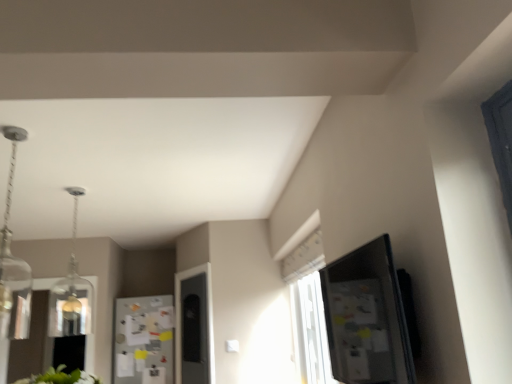
Question: Are clear glass pendant at upper left, the second light fixture positioned from the back, and white paperboard fridge at center beside each other?

Choices:
 (A) yes
 (B) no

Answer: (B)

Question: Is clear glass pendant at upper left, the second light fixture positioned from the back, oriented away from white paperboard fridge at center?

Choices:
 (A) no
 (B) yes

Answer: (A)

Question: Does clear glass pendant at upper left, the 1th light fixture from the front, appear on the right side of white paperboard fridge at center?

Choices:
 (A) no
 (B) yes

Answer: (B)

Question: From a real-world perspective, is clear glass pendant at upper left, the 1th light fixture from the front, on top of white paperboard fridge at center?

Choices:
 (A) no
 (B) yes

Answer: (B)

Question: From the image's perspective, is clear glass pendant at upper left, the second light fixture positioned from the back, under white paperboard fridge at center?

Choices:
 (A) no
 (B) yes

Answer: (A)

Question: Is clear glass pendant at upper left, the 1th light fixture from the front, wider than white paperboard fridge at center?

Choices:
 (A) yes
 (B) no

Answer: (A)

Question: Would you say white paperboard fridge at center is outside clear glass pendant light at upper left, which appears as the 2th light fixture when viewed from the front?

Choices:
 (A) no
 (B) yes

Answer: (B)

Question: From a real-world perspective, does white paperboard fridge at center stand above clear glass pendant light at upper left, which appears as the 2th light fixture when viewed from the front?

Choices:
 (A) yes
 (B) no

Answer: (B)

Question: Considering the relative positions of white paperboard fridge at center and clear glass pendant light at upper left, which appears as the 2th light fixture when viewed from the front, in the image provided, is white paperboard fridge at center to the right of clear glass pendant light at upper left, which appears as the 2th light fixture when viewed from the front, from the viewer's perspective?

Choices:
 (A) no
 (B) yes

Answer: (B)

Question: Is the position of white paperboard fridge at center more distant than that of clear glass pendant light at upper left, which appears as the 2th light fixture when viewed from the front?

Choices:
 (A) no
 (B) yes

Answer: (B)

Question: Is clear glass pendant light at upper left, which appears as the 2th light fixture when viewed from the front, inside white paperboard fridge at center?

Choices:
 (A) no
 (B) yes

Answer: (A)

Question: Considering the relative sizes of white paperboard fridge at center and clear glass pendant light at upper left, which ranks as the first light fixture in back-to-front order, in the image provided, is white paperboard fridge at center shorter than clear glass pendant light at upper left, which ranks as the first light fixture in back-to-front order,?

Choices:
 (A) no
 (B) yes

Answer: (A)

Question: From the image's perspective, is clear glass pendant at upper left, the 1th light fixture from the front, on clear glass pendant light at upper left, which appears as the 2th light fixture when viewed from the front?

Choices:
 (A) no
 (B) yes

Answer: (B)